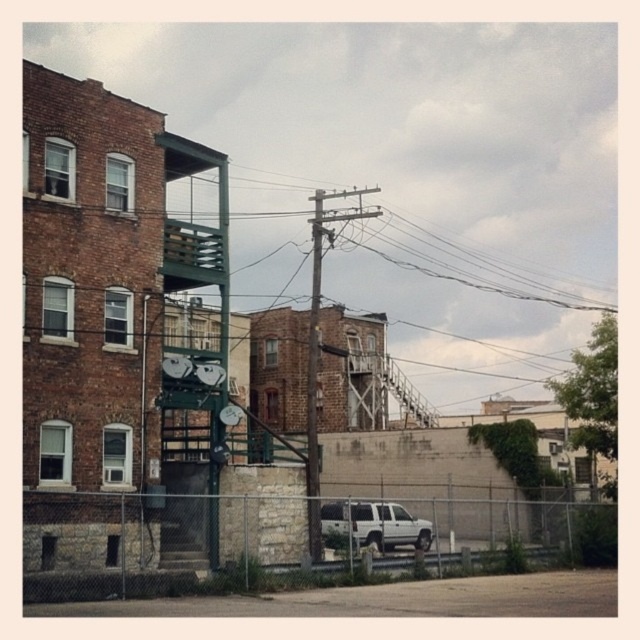
Question: Where is gray chain-link fence at lower center located in relation to smooth wooden utility pole at center in the image?

Choices:
 (A) left
 (B) right

Answer: (B)

Question: Which object is positioned farthest from the gray chain-link fence at lower center?

Choices:
 (A) white matte suv at lower center
 (B) smooth wooden utility pole at center

Answer: (B)

Question: Does white matte suv at lower center appear under smooth wooden utility pole at center?

Choices:
 (A) yes
 (B) no

Answer: (A)

Question: Can you confirm if gray chain-link fence at lower center is smaller than smooth wooden utility pole at center?

Choices:
 (A) yes
 (B) no

Answer: (A)

Question: Among these objects, which one is farthest from the camera?

Choices:
 (A) smooth wooden utility pole at center
 (B) white matte suv at lower center
 (C) gray chain-link fence at lower center

Answer: (B)

Question: Considering the real-world distances, which object is farthest from the white matte suv at lower center?

Choices:
 (A) smooth wooden utility pole at center
 (B) gray chain-link fence at lower center

Answer: (A)